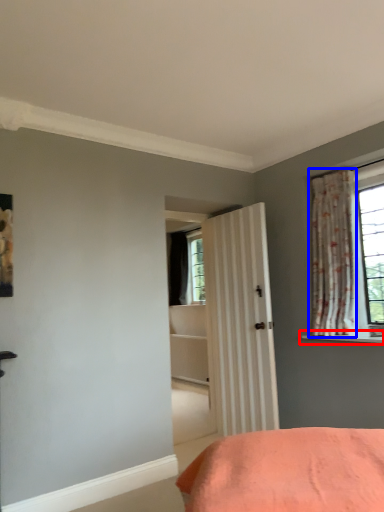
Question: Which of the following is the farthest to the observer, window sill (highlighted by a red box) or curtain (highlighted by a blue box)?

Choices:
 (A) window sill
 (B) curtain

Answer: (B)